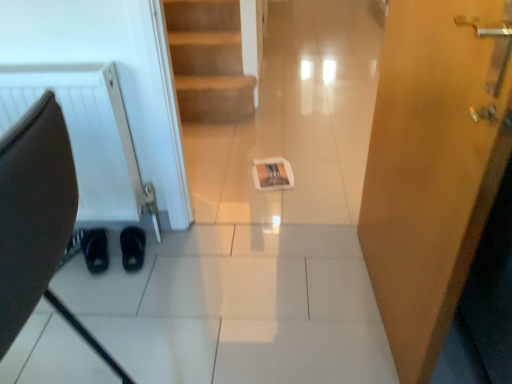
Question: Is white textured radiator at left far away from wooden door at right?

Choices:
 (A) yes
 (B) no

Answer: (A)

Question: From a real-world perspective, is white textured radiator at left positioned under wooden door at right based on gravity?

Choices:
 (A) yes
 (B) no

Answer: (A)

Question: Is white textured radiator at left to the left of wooden door at right from the viewer's perspective?

Choices:
 (A) yes
 (B) no

Answer: (A)

Question: Could you tell me if white textured radiator at left is turned towards wooden door at right?

Choices:
 (A) yes
 (B) no

Answer: (B)

Question: From the image's perspective, is white textured radiator at left under wooden door at right?

Choices:
 (A) no
 (B) yes

Answer: (A)

Question: Visually, is white textured radiator at left positioned to the left or to the right of matte paper magazine at center?

Choices:
 (A) right
 (B) left

Answer: (B)

Question: Is white textured radiator at left bigger or smaller than matte paper magazine at center?

Choices:
 (A) small
 (B) big

Answer: (B)

Question: From the image's perspective, relative to matte paper magazine at center, is white textured radiator at left above or below?

Choices:
 (A) above
 (B) below

Answer: (A)

Question: Considering the positions of white textured radiator at left and matte paper magazine at center in the image, is white textured radiator at left wider or thinner than matte paper magazine at center?

Choices:
 (A) wide
 (B) thin

Answer: (B)

Question: Considering the positions of white textured radiator at left and black suede shoes at lower left, the first footwear from the left, in the image, is white textured radiator at left bigger or smaller than black suede shoes at lower left, the first footwear from the left,?

Choices:
 (A) big
 (B) small

Answer: (A)

Question: In the image, is white textured radiator at left on the left side or the right side of black suede shoes at lower left, the first footwear from the left?

Choices:
 (A) left
 (B) right

Answer: (A)

Question: Is white textured radiator at left taller or shorter than black suede shoes at lower left, the first footwear from the left?

Choices:
 (A) short
 (B) tall

Answer: (B)

Question: From the image's perspective, is white textured radiator at left positioned above or below black suede shoes at lower left, the first footwear from the left?

Choices:
 (A) below
 (B) above

Answer: (B)

Question: Would you say wooden door at right is inside or outside brown leather swivel chair at left?

Choices:
 (A) outside
 (B) inside

Answer: (A)

Question: Is wooden door at right to the left or to the right of brown leather swivel chair at left in the image?

Choices:
 (A) left
 (B) right

Answer: (B)